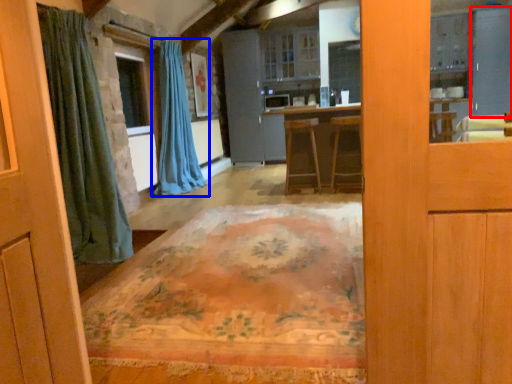
Question: Among these objects, which one is nearest to the camera, screen door (highlighted by a red box) or curtain (highlighted by a blue box)?

Choices:
 (A) screen door
 (B) curtain

Answer: (B)